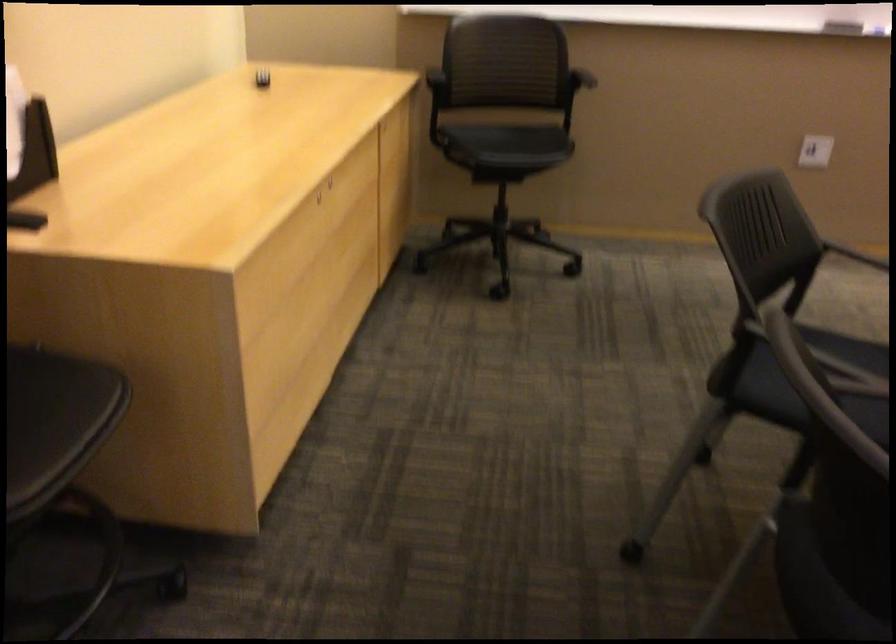
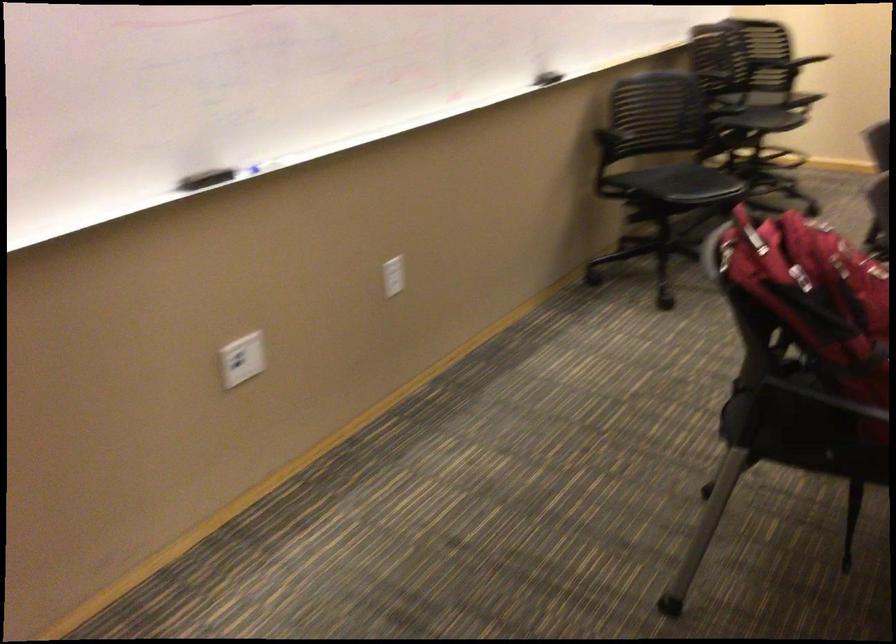
Where in the second image is the point corresponding to (811,140) from the first image?

(242, 359)